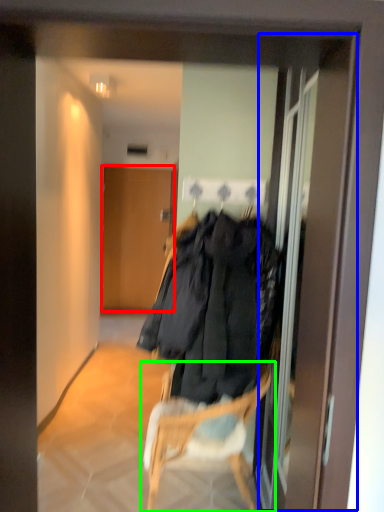
Question: Considering the real-world distances, which object is farthest from door (highlighted by a red box)? screen door (highlighted by a blue box) or chair (highlighted by a green box)?

Choices:
 (A) screen door
 (B) chair

Answer: (B)